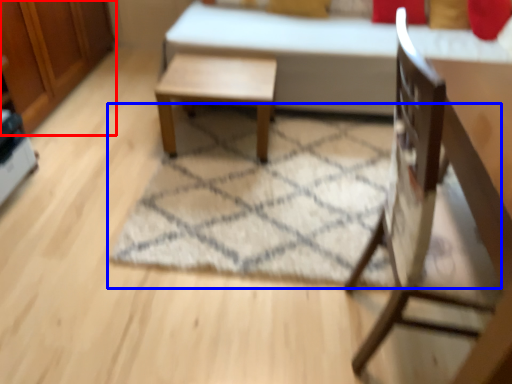
Question: Which object appears farthest to the camera in this image, dresser (highlighted by a red box) or mat (highlighted by a blue box)?

Choices:
 (A) dresser
 (B) mat

Answer: (A)